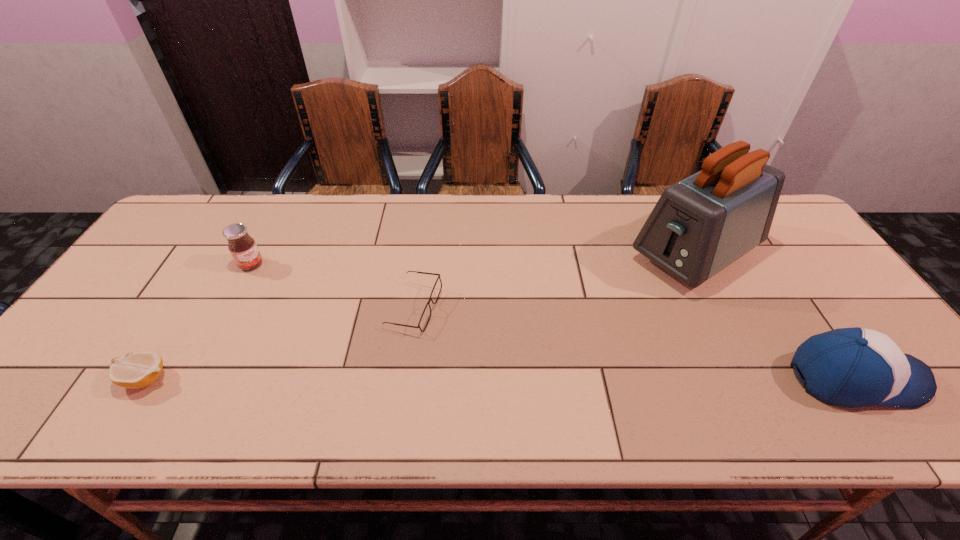
Choose which object is the nearest neighbor to the toaster. Please provide its 2D coordinates. Your answer should be formatted as a tuple, i.e. [(x, y)], where the tuple contains the x and y coordinates of a point satisfying the conditions above.

[(854, 367)]

This screenshot has height=540, width=960. I want to click on free space that satisfies the following two spatial constraints: 1. on the front side of the baseball cap; 2. on the front-facing side of the third object from right to left, so click(404, 379).

Where is `vacant space that satisfies the following two spatial constraints: 1. on the back side of the jam; 2. on the right side of the leftmost object`? Image resolution: width=960 pixels, height=540 pixels. vacant space that satisfies the following two spatial constraints: 1. on the back side of the jam; 2. on the right side of the leftmost object is located at coordinates (216, 265).

You are a GUI agent. You are given a task and a screenshot of the screen. Output one action in this format:
    pyautogui.click(x=<x>, y=<y>)
    Task: Click on the free location that satisfies the following two spatial constraints: 1. on the back side of the leftmost object; 2. on the left side of the third object from left to right
    
    Given the screenshot: What is the action you would take?
    189,308